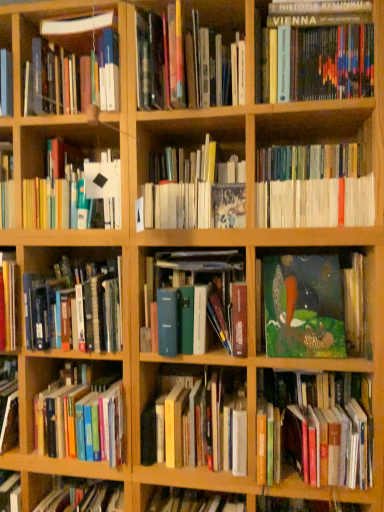
Question: Is hardcover book at upper center, arranged as the 12th book when ordered from the bottom, a part of oil painting at center, the fifth book in the bottom-to-top sequence?

Choices:
 (A) no
 (B) yes

Answer: (A)

Question: Does oil painting at center, the fifth book in the bottom-to-top sequence, have a lesser height compared to hardcover book at upper center, arranged as the 12th book when ordered from the bottom?

Choices:
 (A) no
 (B) yes

Answer: (B)

Question: Is oil painting at center, which is the 8th book from top to bottom, facing towards hardcover book at upper center, arranged as the 12th book when ordered from the bottom?

Choices:
 (A) no
 (B) yes

Answer: (A)

Question: Does oil painting at center, the fifth book in the bottom-to-top sequence, lie in front of hardcover book at upper center, arranged as the 12th book when ordered from the bottom?

Choices:
 (A) no
 (B) yes

Answer: (A)

Question: Does oil painting at center, which is the 8th book from top to bottom, have a larger size compared to hardcover book at upper center, arranged as the 12th book when ordered from the bottom?

Choices:
 (A) no
 (B) yes

Answer: (A)

Question: Is oil painting at center, which is the 8th book from top to bottom, thinner than hardcover book at upper center, arranged as the 12th book when ordered from the bottom?

Choices:
 (A) yes
 (B) no

Answer: (A)

Question: Is white matte book at upper left, the fifth book positioned from the top, positioned before green matte painting at center right, the third book in the bottom-to-top sequence?

Choices:
 (A) no
 (B) yes

Answer: (A)

Question: Considering the relative sizes of white matte book at upper left, which appears as the eighth book when ordered from the bottom, and green matte painting at center right, which is counted as the tenth book, starting from the top, in the image provided, is white matte book at upper left, which appears as the eighth book when ordered from the bottom, thinner than green matte painting at center right, which is counted as the tenth book, starting from the top,?

Choices:
 (A) yes
 (B) no

Answer: (B)

Question: Is white matte book at upper left, which appears as the eighth book when ordered from the bottom, outside green matte painting at center right, which is counted as the tenth book, starting from the top?

Choices:
 (A) yes
 (B) no

Answer: (A)

Question: Is green matte painting at center right, which is counted as the tenth book, starting from the top, completely or partially inside white matte book at upper left, which appears as the eighth book when ordered from the bottom?

Choices:
 (A) no
 (B) yes

Answer: (A)

Question: From a real-world perspective, is white matte book at upper left, which appears as the eighth book when ordered from the bottom, located higher than green matte painting at center right, which is counted as the tenth book, starting from the top?

Choices:
 (A) no
 (B) yes

Answer: (B)

Question: Can you confirm if white matte book at upper left, which appears as the eighth book when ordered from the bottom, is taller than green matte painting at center right, the third book in the bottom-to-top sequence?

Choices:
 (A) no
 (B) yes

Answer: (B)

Question: Does hardcover book at center, positioned as the eleventh book in top-to-bottom order, have a greater width compared to green matte painting at center right, the third book in the bottom-to-top sequence?

Choices:
 (A) yes
 (B) no

Answer: (A)